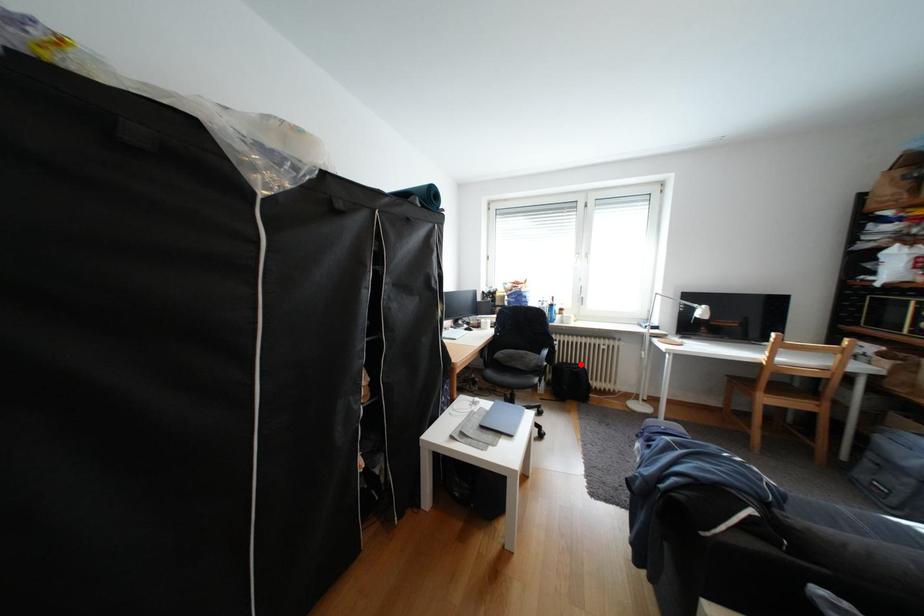
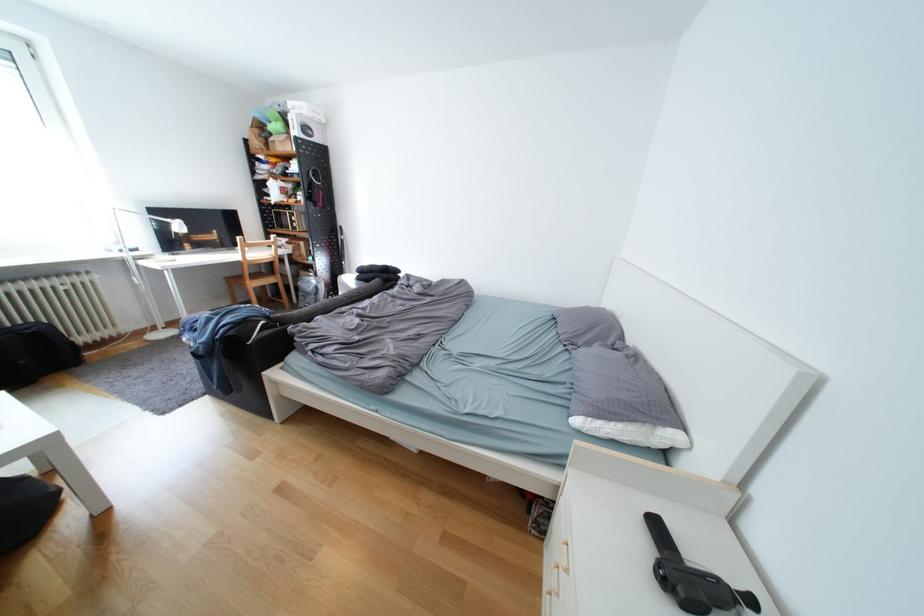
Question: I am providing you with two images of the same scene from different viewpoints. Image1 has a red point marked. In image2, the corresponding 3D location appears at what relative position? Reply with the corresponding letter.

Choices:
 (A) Closer
 (B) Farther

Answer: (B)